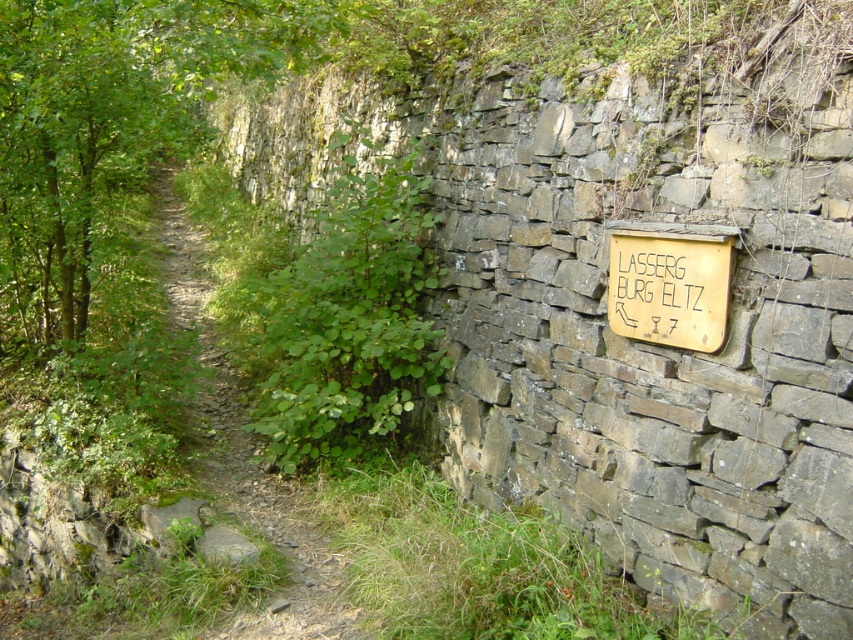
Is point (192, 124) more distant than point (677, 275)?

Yes, point (192, 124) is behind point (677, 275).

Who is higher up, green leafy tree at center or wooden sign at right?

green leafy tree at center is above.

Which is behind, point (126, 168) or point (619, 243)?

The point (126, 168) is behind.

Identify the location of green leafy tree at center. This screenshot has width=853, height=640. (112, 124).

Who is lower down, dirt path at left or yellow paper sign at right?

yellow paper sign at right

Measure the distance between dirt path at left and yellow paper sign at right.

dirt path at left and yellow paper sign at right are 8.78 feet apart from each other.

Locate an element on the screen. Image resolution: width=853 pixels, height=640 pixels. dirt path at left is located at coordinates (248, 456).

Can you confirm if dirt path at left is taller than wooden sign at right?

Yes, dirt path at left is taller than wooden sign at right.

Is the position of dirt path at left more distant than that of wooden sign at right?

Yes.

Between point (331, 625) and point (688, 243), which one is positioned behind?

Positioned behind is point (331, 625).

I want to click on dirt path at left, so click(248, 456).